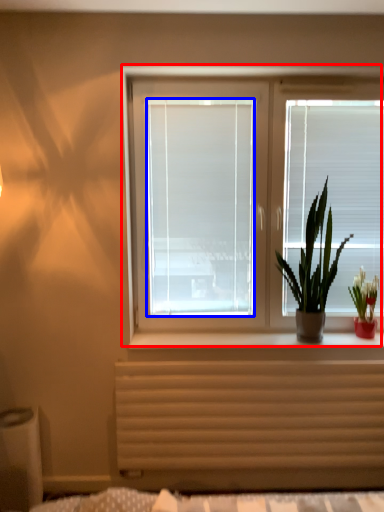
Question: Which of the following is the closest to the observer, window (highlighted by a red box) or window screen (highlighted by a blue box)?

Choices:
 (A) window
 (B) window screen

Answer: (A)